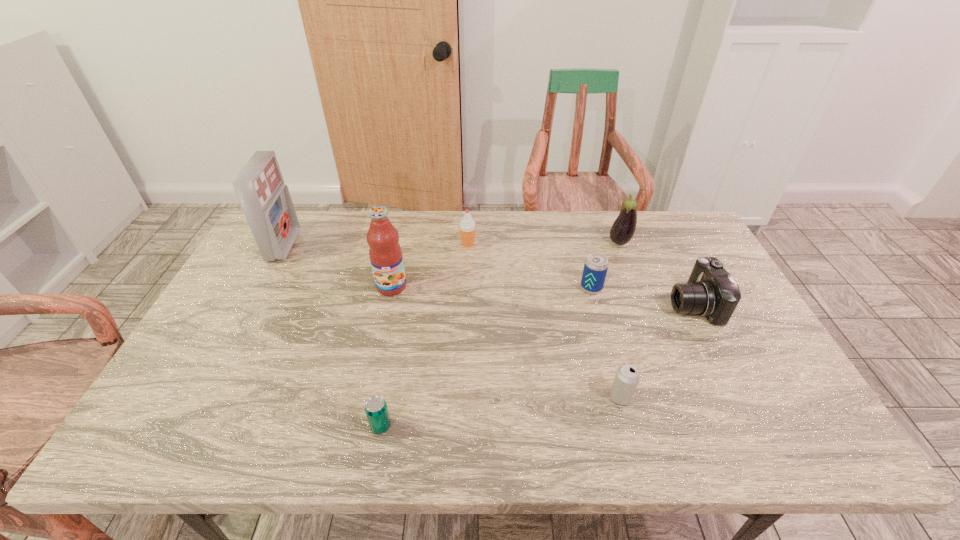
Where is `free spot between the leftmost object and the eggplant`? The height and width of the screenshot is (540, 960). free spot between the leftmost object and the eggplant is located at coordinates (452, 244).

Identify the location of vacant point located between the icecream and the farthest beer can. (530, 266).

The image size is (960, 540). Find the location of `free space between the leftmost object and the fruit juice`. free space between the leftmost object and the fruit juice is located at coordinates (338, 266).

Where is `unoccupied area between the farthest beer can and the seventh farthest object`? The image size is (960, 540). unoccupied area between the farthest beer can and the seventh farthest object is located at coordinates pyautogui.click(x=606, y=342).

Identify the location of object that is the fifth closest one to the icecream. The height and width of the screenshot is (540, 960). (711, 291).

This screenshot has width=960, height=540. Find the location of `the second closest object to the second farthest beer can`. the second closest object to the second farthest beer can is located at coordinates (596, 265).

The height and width of the screenshot is (540, 960). Find the location of `the second closest beer can to the eggplant`. the second closest beer can to the eggplant is located at coordinates (627, 377).

Find the location of a particular element. The image size is (960, 540). beer can object that ranks as the closest to the camera is located at coordinates [596, 265].

Find the location of a particular element. The width and height of the screenshot is (960, 540). vacant space that satisfies the following two spatial constraints: 1. on the back side of the leftmost beer can; 2. on the front-facing side of the leftmost object is located at coordinates (414, 246).

Identify the location of vacant area in the image that satisfies the following two spatial constraints: 1. on the front-facing side of the farthest beer can; 2. on the right side of the first-aid kit. The width and height of the screenshot is (960, 540). (262, 288).